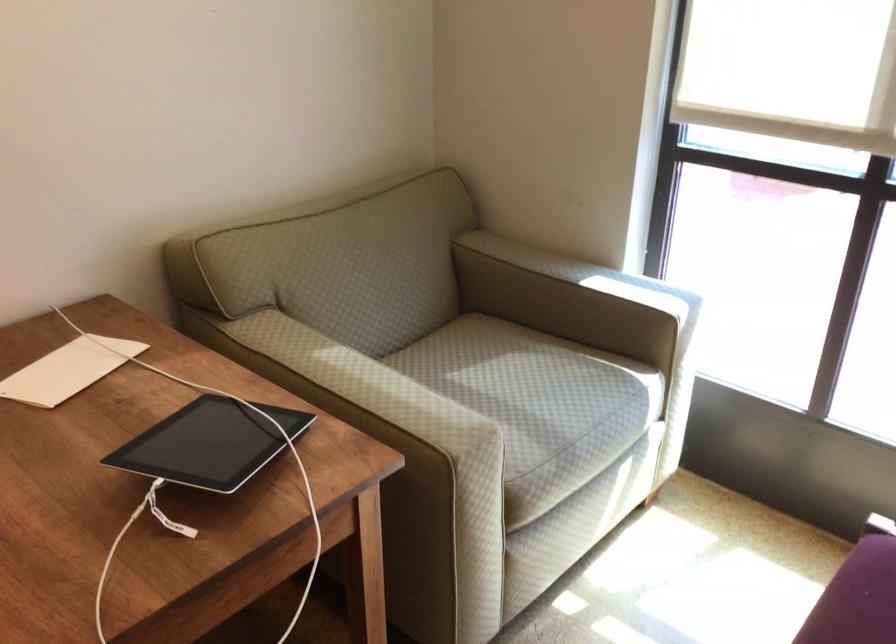
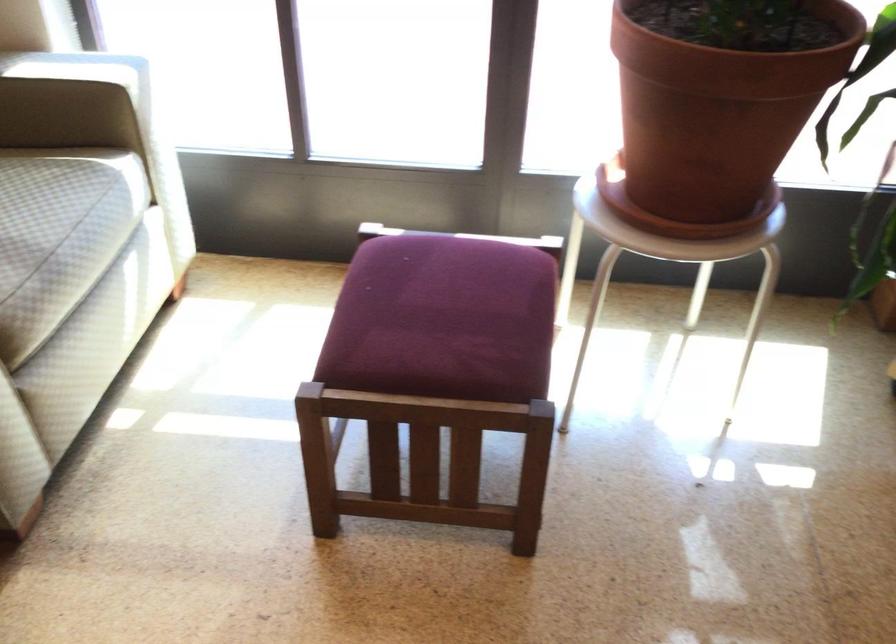
The point at (x=625, y=292) is marked in the first image. Where is the corresponding point in the second image?

(73, 69)